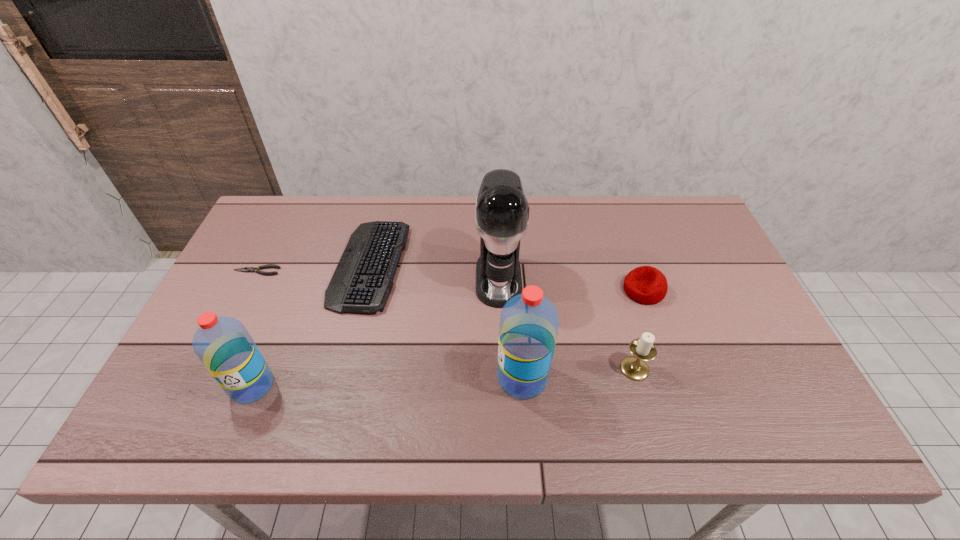
The height and width of the screenshot is (540, 960). Identify the location of the left water bottle. (223, 344).

You are a GUI agent. You are given a task and a screenshot of the screen. Output one action in this format:
    pyautogui.click(x=<x>, y=<y>)
    Task: Click on the fifth shortest object
    The width and height of the screenshot is (960, 540).
    Given the screenshot: What is the action you would take?
    pyautogui.click(x=223, y=344)

The width and height of the screenshot is (960, 540). Find the location of `the taller water bottle`. the taller water bottle is located at coordinates (529, 322).

I want to click on the third shortest object, so click(x=646, y=285).

The height and width of the screenshot is (540, 960). Identify the location of pliers. (246, 269).

Where is `the leftmost object`? Image resolution: width=960 pixels, height=540 pixels. the leftmost object is located at coordinates (246, 269).

This screenshot has width=960, height=540. I want to click on the second shortest object, so click(363, 279).

Where is `the third object from left to right`? The height and width of the screenshot is (540, 960). the third object from left to right is located at coordinates (363, 279).

Where is `coffee maker`? coffee maker is located at coordinates (502, 212).

I want to click on the fourth tallest object, so click(x=634, y=367).